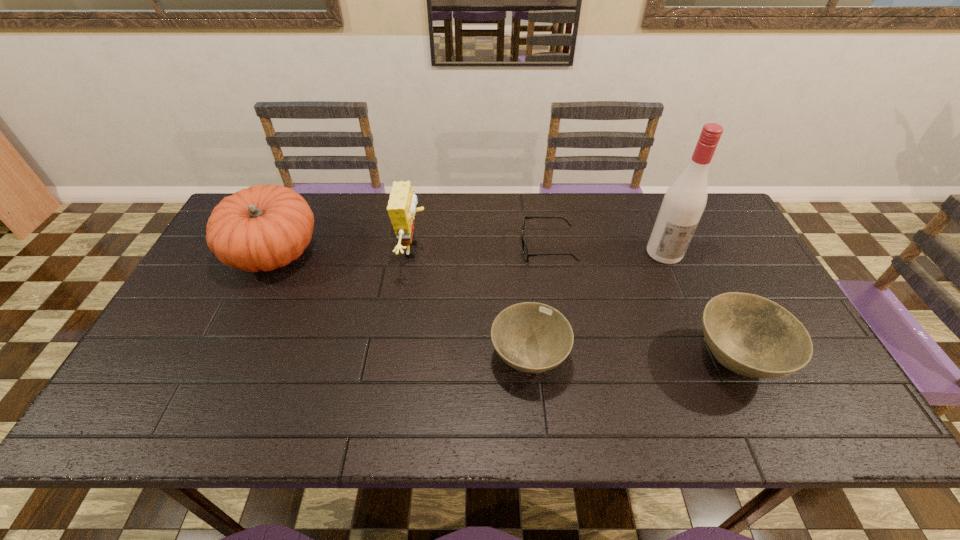
At what (x,y) coordinates should I click in order to perform the action: click on free space located on the right of the pumpkin. Please return your answer as a coordinate pair (x, y). This screenshot has height=540, width=960. Looking at the image, I should click on (410, 253).

The image size is (960, 540). In order to click on vacant area located on the face of the fifth object from right to left in this screenshot , I will do click(x=462, y=250).

Find the location of a particular element. vacant space located on the label of the alcohol is located at coordinates point(690,313).

I want to click on vacant space situated on the front-facing side of the spectacles, so click(468, 248).

Locate an element on the screen. The image size is (960, 540). vacant region located on the front-facing side of the spectacles is located at coordinates (448, 248).

Locate an element on the screen. free spot located on the front-facing side of the spectacles is located at coordinates (481, 248).

Find the location of a particular element. This screenshot has height=540, width=960. pumpkin positioned at the far edge is located at coordinates (264, 227).

Identify the location of sponge located at the far edge. (401, 208).

The height and width of the screenshot is (540, 960). What are the coordinates of `spectacles at the far edge` in the screenshot? It's located at (526, 254).

Find the location of `object that is at the left edge`. object that is at the left edge is located at coordinates (264, 227).